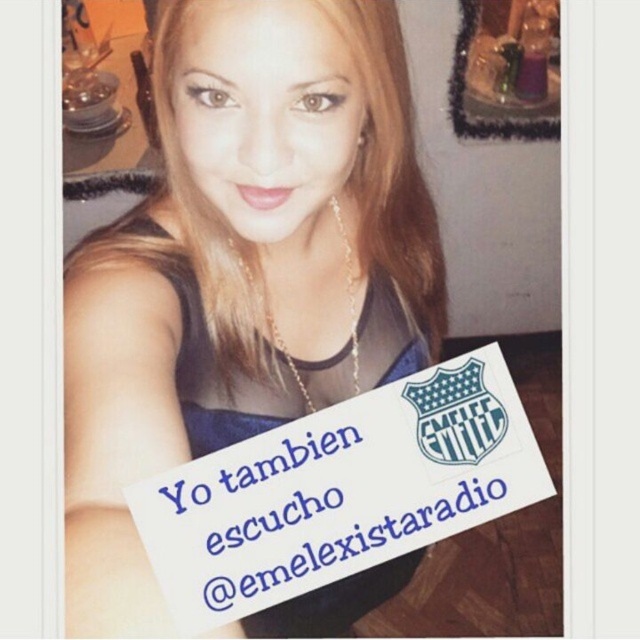
Question: Observing the image, what is the correct spatial positioning of matte blue sign at center in reference to white paper sign at center?

Choices:
 (A) above
 (B) below

Answer: (A)

Question: Which object is closer to the camera taking this photo?

Choices:
 (A) white paper sign at center
 (B) matte blue sign at center

Answer: (B)

Question: In this image, where is matte blue sign at center located relative to white paper sign at center?

Choices:
 (A) below
 (B) above

Answer: (B)

Question: In this image, where is matte blue sign at center located relative to white paper sign at center?

Choices:
 (A) above
 (B) below

Answer: (A)